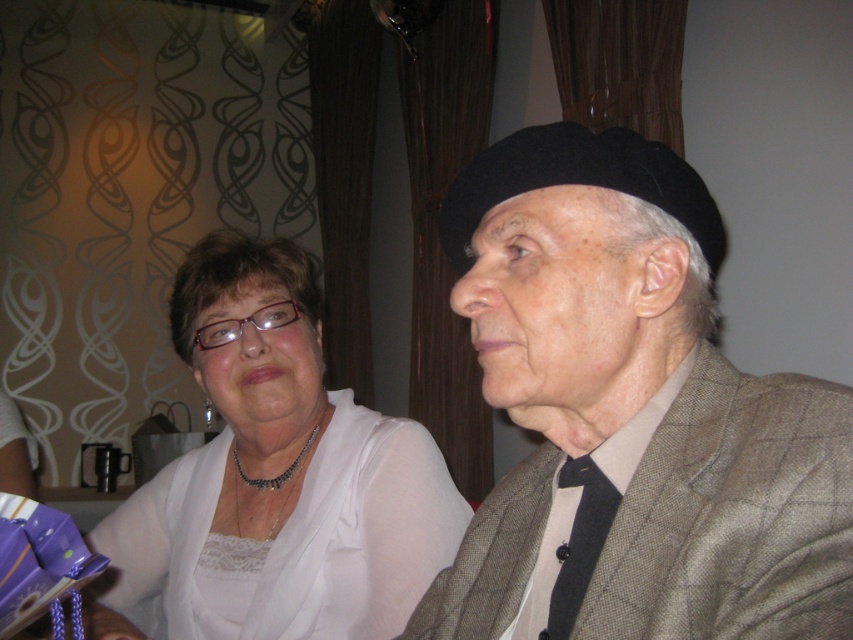
You are a photographer setting up for a portrait. You need to ensure that the white satin blouse at center and the black textured tie at center are both visible in the frame. Which one should you focus on to ensure it appears larger in the photo?

The white satin blouse at center is taller than the black textured tie at center, so focusing on the white satin blouse at center will ensure it appears larger in the photo.

You are a photographer trying to capture a closeup of the matte black beret at upper right without the black textured tie at center appearing in the frame. Is this possible given their positions?

The matte black beret at upper right is in front of the black textured tie at center, so yes, you can take a closeup of the matte black beret at upper right without the black textured tie at center showing in the frame.